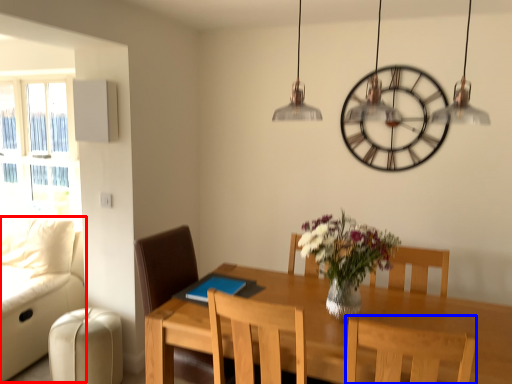
Question: Which object is closer to the camera taking this photo, couch (highlighted by a red box) or chair (highlighted by a blue box)?

Choices:
 (A) couch
 (B) chair

Answer: (B)